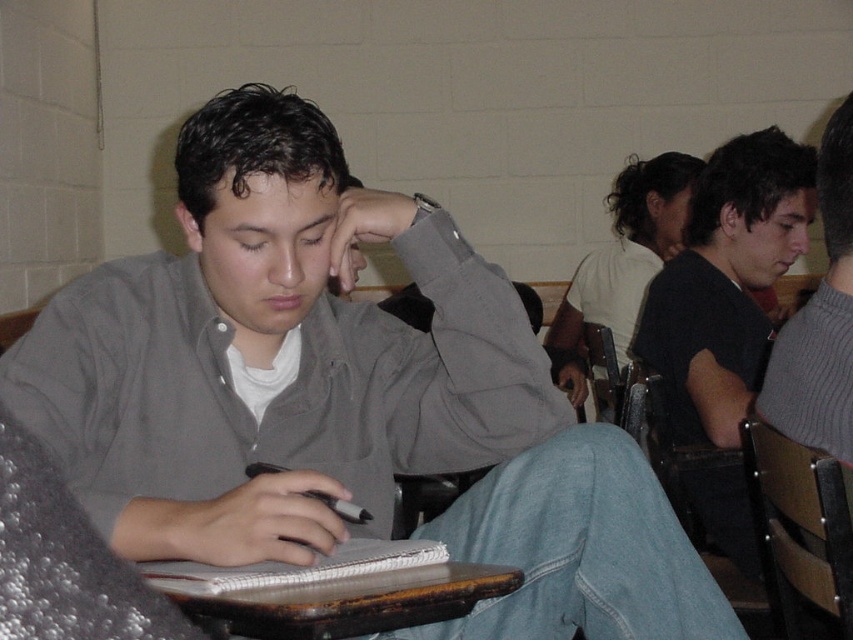
You are a student in the classroom looking at the matte gray shirt at center and the brown wooden table at lower center. Which object is positioned higher from the ground?

The matte gray shirt at center is above the brown wooden table at lower center, so it is positioned higher from the ground.